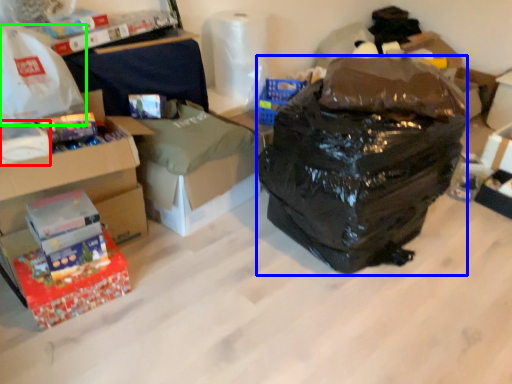
Question: Considering the real-world distances, which object is farthest from box (highlighted by a red box)? garbage (highlighted by a blue box) or plastic bag (highlighted by a green box)?

Choices:
 (A) garbage
 (B) plastic bag

Answer: (A)